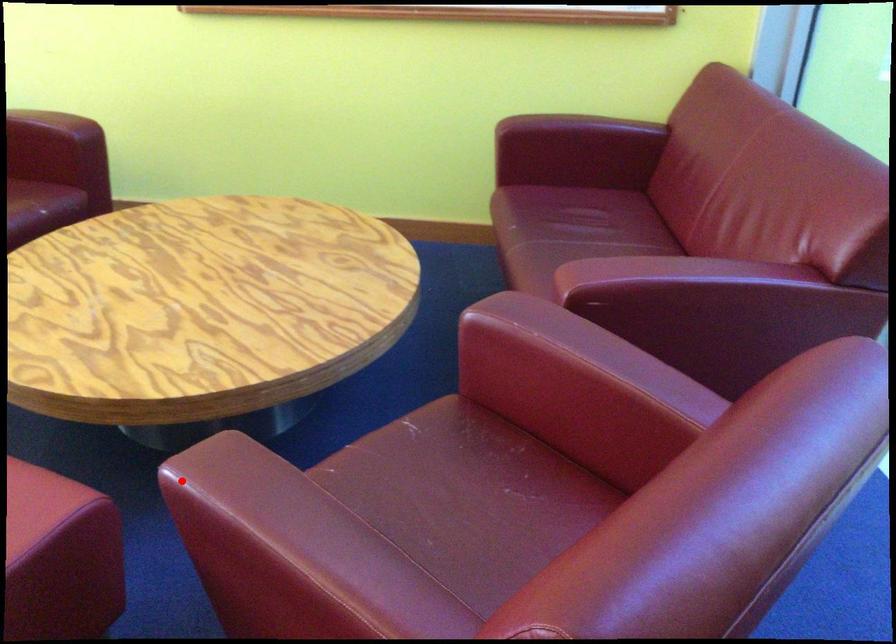
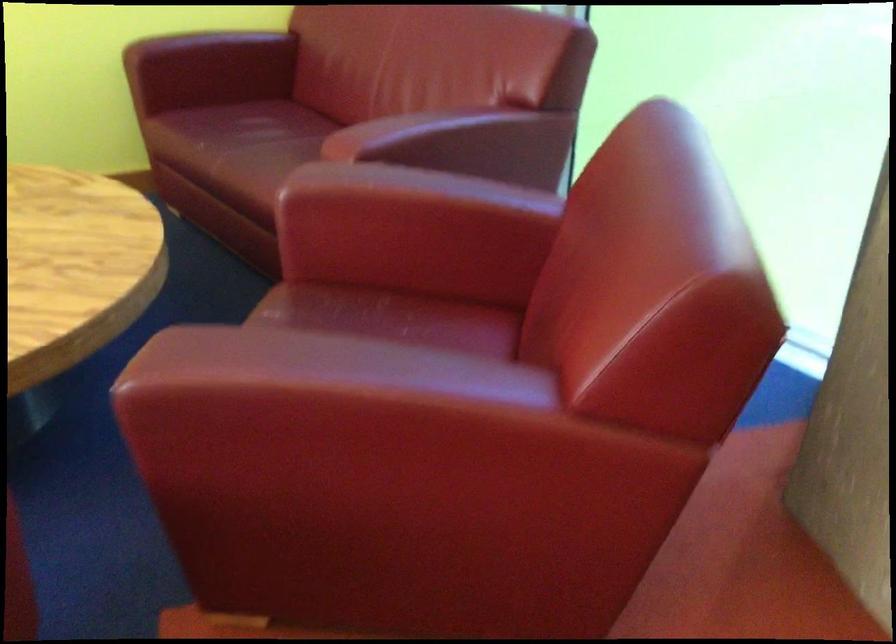
The point at the highlighted location is marked in the first image. Where is the corresponding point in the second image?

(177, 386)